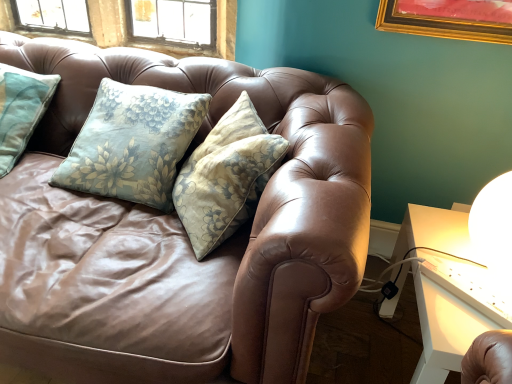
The height and width of the screenshot is (384, 512). Identify the location of brown leather couch at center. (186, 237).

What do you see at coordinates (186, 237) in the screenshot? I see `brown leather couch at center` at bounding box center [186, 237].

The width and height of the screenshot is (512, 384). What are the coordinates of `white glossy table at right` in the screenshot? It's located at (439, 326).

This screenshot has height=384, width=512. Describe the element at coordinates (439, 326) in the screenshot. I see `white glossy table at right` at that location.

Where is `brown leather couch at center`? brown leather couch at center is located at coordinates (186, 237).

Is white glossy table at right to the left of brown leather couch at center from the viewer's perspective?

In fact, white glossy table at right is to the right of brown leather couch at center.

In the image, is white glossy table at right positioned in front of or behind brown leather couch at center?

Clearly, white glossy table at right is behind brown leather couch at center.

Does point (457, 315) come farther from viewer compared to point (26, 291)?

No, it is in front of (26, 291).

From the image's perspective, is white glossy table at right positioned above or below brown leather couch at center?

Clearly, from the image's perspective, white glossy table at right is below brown leather couch at center.

From a real-world perspective, which is physically above, white glossy table at right or brown leather couch at center?

From a 3D spatial view, brown leather couch at center is above.

Does white glossy table at right have a greater width compared to brown leather couch at center?

Incorrect, the width of white glossy table at right does not surpass that of brown leather couch at center.

Considering the sizes of objects white glossy table at right and brown leather couch at center in the image provided, who is taller, white glossy table at right or brown leather couch at center?

Standing taller between the two is brown leather couch at center.

Is white glossy table at right bigger than brown leather couch at center?

No.

Is white glossy table at right located outside brown leather couch at center?

white glossy table at right lies outside brown leather couch at center's area.

Is white glossy table at right touching brown leather couch at center?

No, white glossy table at right is not beside brown leather couch at center.

Is white glossy table at right facing away from brown leather couch at center?

Yes, white glossy table at right is facing away from brown leather couch at center.

Can you tell me how much white glossy table at right and brown leather couch at center differ in facing direction?

white glossy table at right and brown leather couch at center are facing 89 degrees away from each other.

You are a GUI agent. You are given a task and a screenshot of the screen. Output one action in this format:
    pyautogui.click(x=<x>, y=<y>)
    Task: Click on the table that is behind the brown leather couch at center
    Image resolution: width=512 pixels, height=384 pixels.
    Given the screenshot: What is the action you would take?
    pyautogui.click(x=439, y=326)

Is brown leather couch at center at the right side of white glossy table at right?

No, brown leather couch at center is not to the right of white glossy table at right.

Between brown leather couch at center and white glossy table at right, which one is positioned behind?

white glossy table at right is further from the camera.

Which is farther from the camera, (195,332) or (406,273)?

Positioned behind is point (406,273).

From the image's perspective, is brown leather couch at center over white glossy table at right?

Yes, from the image's perspective, brown leather couch at center is on top of white glossy table at right.

From a real-world perspective, between brown leather couch at center and white glossy table at right, who is vertically higher?

From a 3D spatial view, brown leather couch at center is above.

Which object is wider, brown leather couch at center or white glossy table at right?

With larger width is brown leather couch at center.

Between brown leather couch at center and white glossy table at right, which one has more height?

brown leather couch at center is taller.

Can you confirm if brown leather couch at center is smaller than white glossy table at right?

Incorrect, brown leather couch at center is not smaller in size than white glossy table at right.

Would you say brown leather couch at center is inside or outside white glossy table at right?

brown leather couch at center is not enclosed by white glossy table at right.

Is brown leather couch at center not near white glossy table at right?

That's not correct — brown leather couch at center is a little close to white glossy table at right.

From the picture: Is white glossy table at right at the back of brown leather couch at center?

No, white glossy table at right is not at the back of brown leather couch at center.

What's the angular difference between brown leather couch at center and white glossy table at right's facing directions?

There is a 89-degree angle between the facing directions of brown leather couch at center and white glossy table at right.

How distant is brown leather couch at center from white glossy table at right?

brown leather couch at center and white glossy table at right are 22.71 inches apart from each other.

The height and width of the screenshot is (384, 512). I want to click on table behind the brown leather couch at center, so click(439, 326).

Locate an element on the screen. The image size is (512, 384). studio couch above the white glossy table at right (from a real-world perspective) is located at coordinates (186, 237).

You are a GUI agent. You are given a task and a screenshot of the screen. Output one action in this format:
    pyautogui.click(x=<x>, y=<y>)
    Task: Click on the studio couch in front of the white glossy table at right
    Image resolution: width=512 pixels, height=384 pixels.
    Given the screenshot: What is the action you would take?
    pyautogui.click(x=186, y=237)